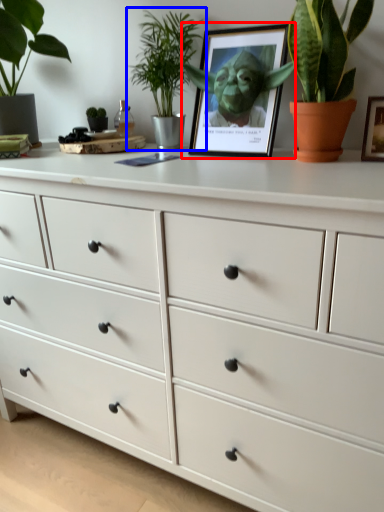
Question: Which object is further to the camera taking this photo, picture frame (highlighted by a red box) or houseplant (highlighted by a blue box)?

Choices:
 (A) picture frame
 (B) houseplant

Answer: (B)